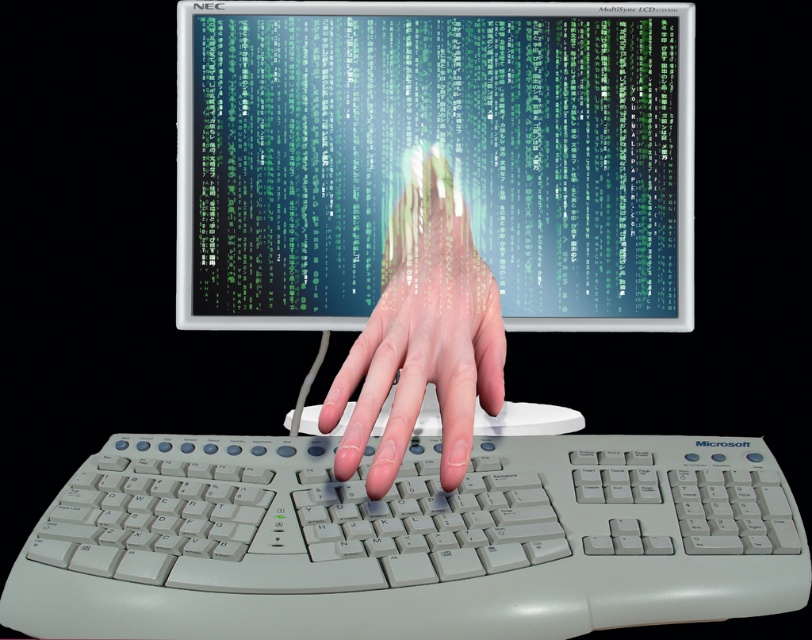
Can you confirm if green matrix code at center is positioned to the left of translucent skin hand at center?

In fact, green matrix code at center is to the right of translucent skin hand at center.

What do you see at coordinates (434, 156) in the screenshot? I see `green matrix code at center` at bounding box center [434, 156].

You are a GUI agent. You are given a task and a screenshot of the screen. Output one action in this format:
    pyautogui.click(x=<x>, y=<y>)
    Task: Click on the green matrix code at center
    The image size is (812, 640).
    Given the screenshot: What is the action you would take?
    pyautogui.click(x=434, y=156)

Which is more to the right, green matrix code at center or white plastic keyboard at center?

Positioned to the right is green matrix code at center.

Does green matrix code at center have a smaller size compared to white plastic keyboard at center?

Correct, green matrix code at center occupies less space than white plastic keyboard at center.

Locate an element on the screen. green matrix code at center is located at coordinates (434, 156).

Locate an element on the screen. white plastic keyboard at center is located at coordinates (409, 540).

Which of these two, white plastic keyboard at center or translucent skin hand at center, stands shorter?

white plastic keyboard at center

Which is behind, point (197, 620) or point (409, 324)?

The point (409, 324) is more distant.

Image resolution: width=812 pixels, height=640 pixels. I want to click on white plastic keyboard at center, so click(409, 540).